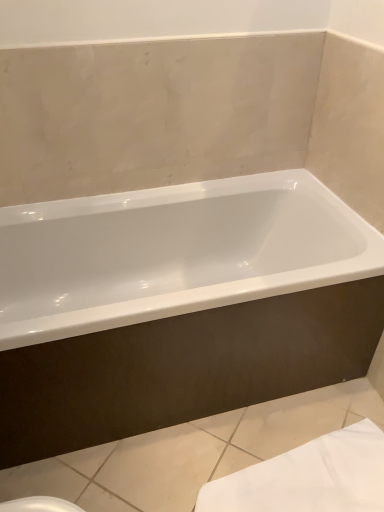
This screenshot has width=384, height=512. In order to click on empty space that is ontop of white fabric towel at lower right in this screenshot , I will do `click(303, 479)`.